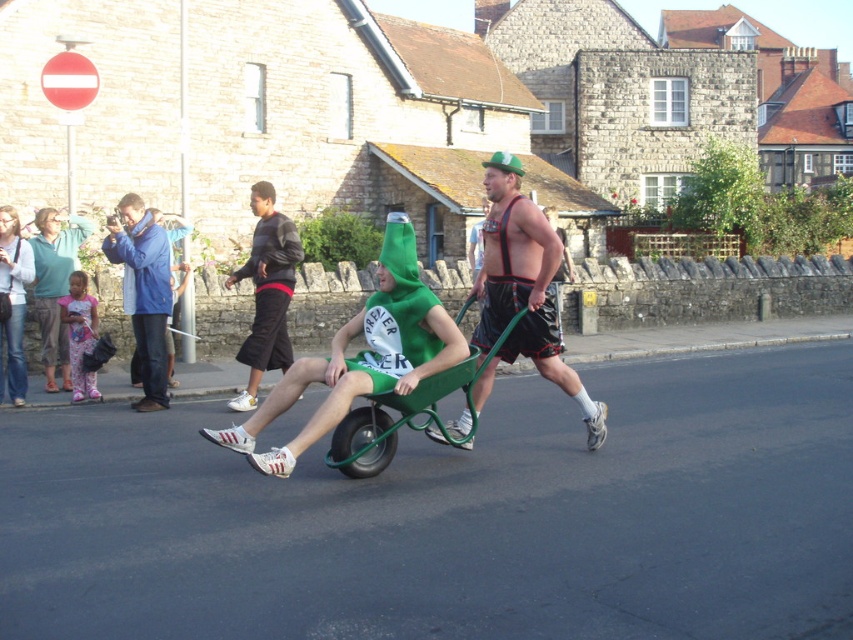
You are a photographer standing in the middle of the street. You want to take a photo of the green plastic wheelbarrow at center and the striped sweater at center. Which object should you focus on first to ensure both are in the frame?

You should focus on the green plastic wheelbarrow at center first since it is closer to the viewer than the striped sweater at center, ensuring both are in the frame.

You are a photographer trying to capture both the striped sweater at center and the blue fabric jacket at left in a single frame. Given their widths, which clothing item will require more horizontal space in the photo?

The striped sweater at center requires more horizontal space in the photo because its width surpasses that of the blue fabric jacket at left.